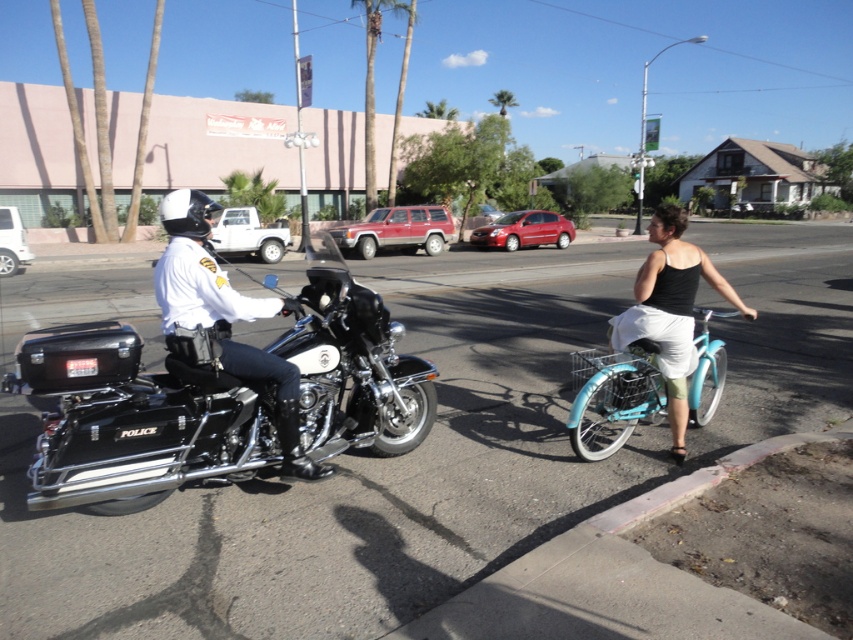
Is black polished police motorcycle at left smaller than teal matte bicycle at center?

Yes.

Between point (328, 413) and point (715, 358), which one is positioned behind?

Positioned behind is point (715, 358).

The width and height of the screenshot is (853, 640). I want to click on black polished police motorcycle at left, so click(x=216, y=397).

Based on the photo, does black polished police motorcycle at left have a lesser height compared to black glossy motorcycle at left?

Correct, black polished police motorcycle at left is not as tall as black glossy motorcycle at left.

Who is positioned more to the right, black polished police motorcycle at left or black glossy motorcycle at left?

black polished police motorcycle at left

Describe the element at coordinates (216, 397) in the screenshot. This screenshot has height=640, width=853. I see `black polished police motorcycle at left` at that location.

At what (x,y) coordinates should I click in order to perform the action: click on black polished police motorcycle at left. Please return your answer as a coordinate pair (x, y). This screenshot has height=640, width=853. Looking at the image, I should click on tap(216, 397).

Between point (293, 397) and point (706, 422), which one is positioned behind?

The point (706, 422) is behind.

Which is more to the right, black glossy motorcycle at left or teal matte bicycle at center?

Positioned to the right is teal matte bicycle at center.

This screenshot has width=853, height=640. Describe the element at coordinates (199, 272) in the screenshot. I see `black glossy motorcycle at left` at that location.

Where is `black glossy motorcycle at left`? The image size is (853, 640). black glossy motorcycle at left is located at coordinates (199, 272).